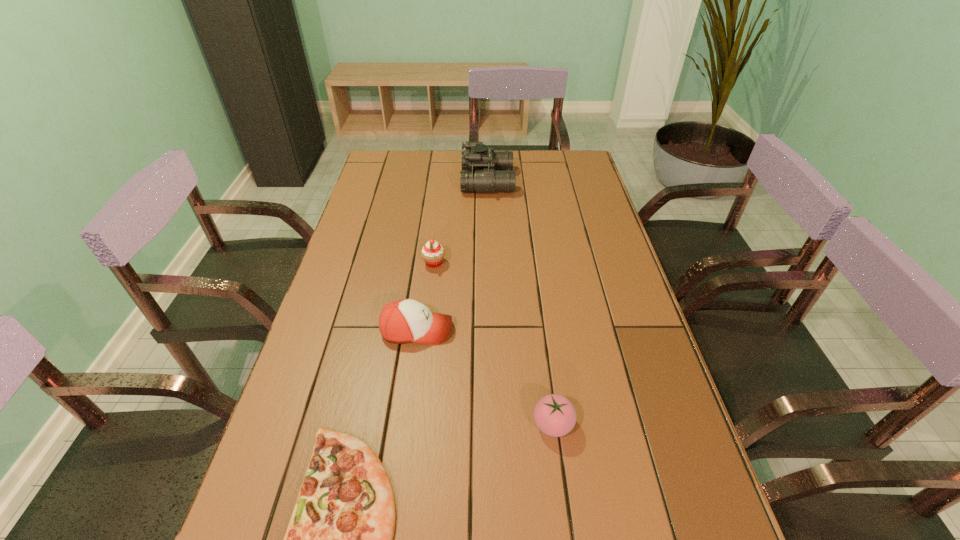
Find the location of a particular element. Image resolution: width=960 pixels, height=540 pixels. blank space located 0.050m on the back of the tomato is located at coordinates (548, 386).

Find the location of a particular element. This screenshot has width=960, height=540. object that is positioned at the far edge is located at coordinates (484, 170).

Locate an element on the screen. The image size is (960, 540). free space at the left edge of the desktop is located at coordinates (372, 319).

I want to click on vacant space at the right edge of the desktop, so click(x=564, y=236).

I want to click on vacant space at the far left corner, so click(x=405, y=153).

Find the location of `vacant region at the far right corner of the desktop`. vacant region at the far right corner of the desktop is located at coordinates (574, 157).

Where is `blank region between the baseball cap and the cupcake`? blank region between the baseball cap and the cupcake is located at coordinates (425, 296).

Locate an element on the screen. This screenshot has height=540, width=960. unoccupied area between the third farthest object and the tomato is located at coordinates (485, 377).

Where is `unoccupied area between the third nearest object and the tallest object`? unoccupied area between the third nearest object and the tallest object is located at coordinates (452, 255).

The width and height of the screenshot is (960, 540). I want to click on vacant point located between the third farthest object and the cupcake, so click(x=425, y=296).